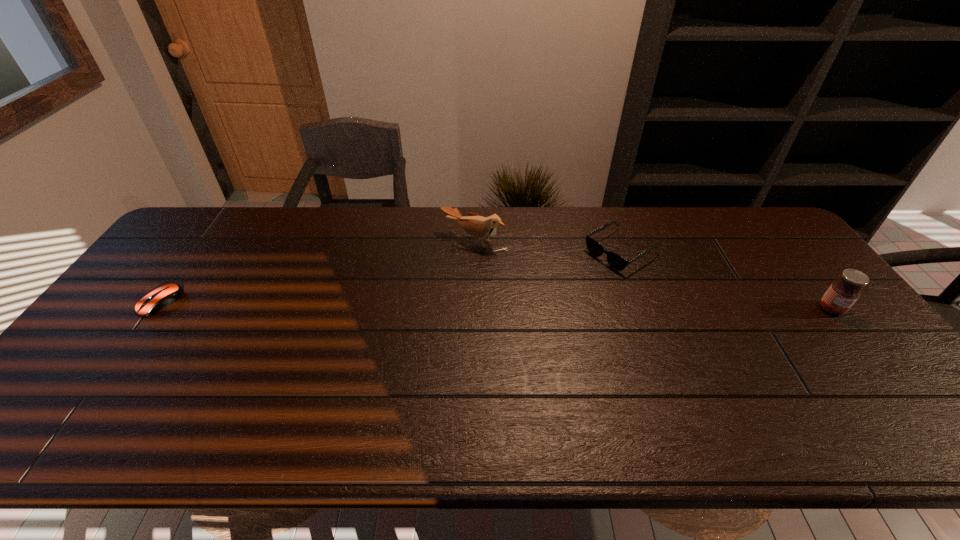
Identify the location of free space at the left edge of the desktop. This screenshot has width=960, height=540. (188, 252).

In the image, there is a desktop. Where is `free space at the far left corner`? free space at the far left corner is located at coordinates (186, 224).

Locate an element on the screen. This screenshot has width=960, height=540. vacant region at the near left corner of the desktop is located at coordinates (114, 382).

Where is `vacant region at the far right corner of the desktop`? vacant region at the far right corner of the desktop is located at coordinates (760, 227).

Where is `empty location between the second shortest object and the shortest object`? empty location between the second shortest object and the shortest object is located at coordinates (391, 277).

The image size is (960, 540). In order to click on unoccupied position between the second object from right to left and the third object from right to left in this screenshot , I will do `click(547, 246)`.

Identify the location of empty space between the sunglasses and the jam. Image resolution: width=960 pixels, height=540 pixels. click(x=726, y=280).

Image resolution: width=960 pixels, height=540 pixels. In order to click on unoccupied area between the third object from right to left and the third tallest object in this screenshot , I will do `click(547, 246)`.

Where is `free space between the rightmost object and the leftmost object`? free space between the rightmost object and the leftmost object is located at coordinates (495, 306).

Find the location of a particular element. free space between the jam and the shortest object is located at coordinates (495, 306).